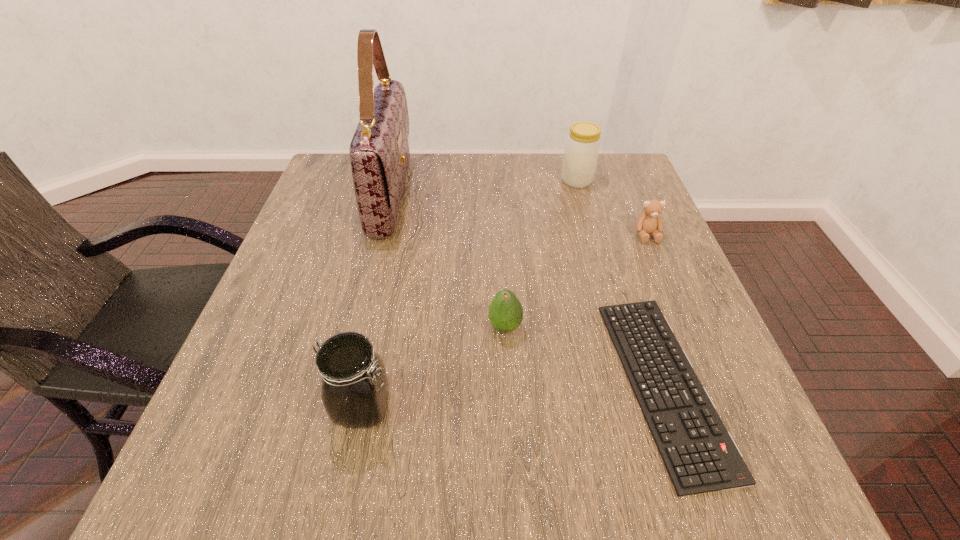
I want to click on free space that satisfies the following two spatial constraints: 1. on the front of the handbag with the clasp; 2. on the back side of the computer keyboard, so click(345, 384).